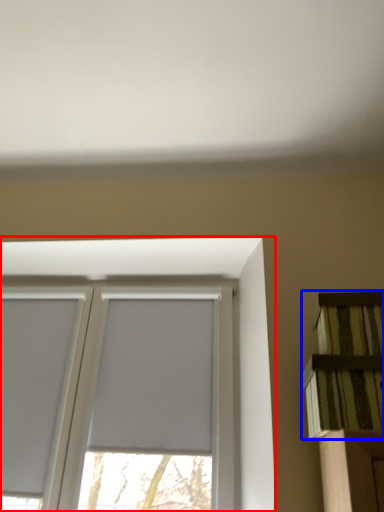
Question: Which object appears farthest to the camera in this image, window (highlighted by a red box) or shelf (highlighted by a blue box)?

Choices:
 (A) window
 (B) shelf

Answer: (A)